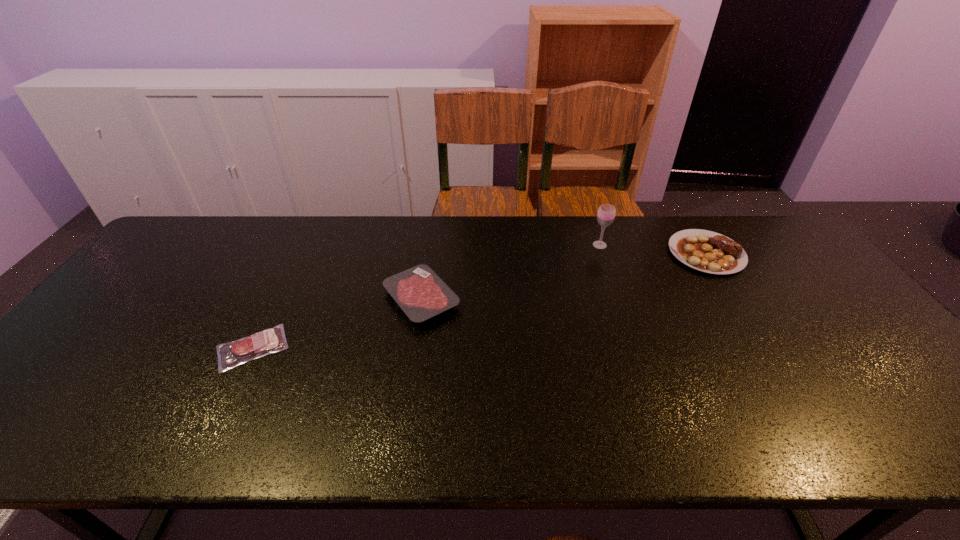
This screenshot has width=960, height=540. Identify the location of the tallest object. (606, 213).

At what (x,y) coordinates should I click in order to perform the action: click on the second object from right to left. Please return your answer as a coordinate pair (x, y). Looking at the image, I should click on (606, 213).

Where is `the second tallest object`? the second tallest object is located at coordinates coord(703,250).

Where is `the tallest steak`? This screenshot has width=960, height=540. the tallest steak is located at coordinates (703, 250).

This screenshot has width=960, height=540. What are the coordinates of `the third object from right to left` in the screenshot? It's located at (419, 291).

Where is `the second shortest object`? The image size is (960, 540). the second shortest object is located at coordinates (419, 291).

Locate an element on the screen. This screenshot has height=540, width=960. the shortest object is located at coordinates (271, 340).

The width and height of the screenshot is (960, 540). I want to click on the shortest steak, so click(271, 340).

Image resolution: width=960 pixels, height=540 pixels. I want to click on vacant area located 0.220m on the left of the tallest object, so click(523, 245).

Where is `free space located on the front of the rightmost steak`? free space located on the front of the rightmost steak is located at coordinates (786, 381).